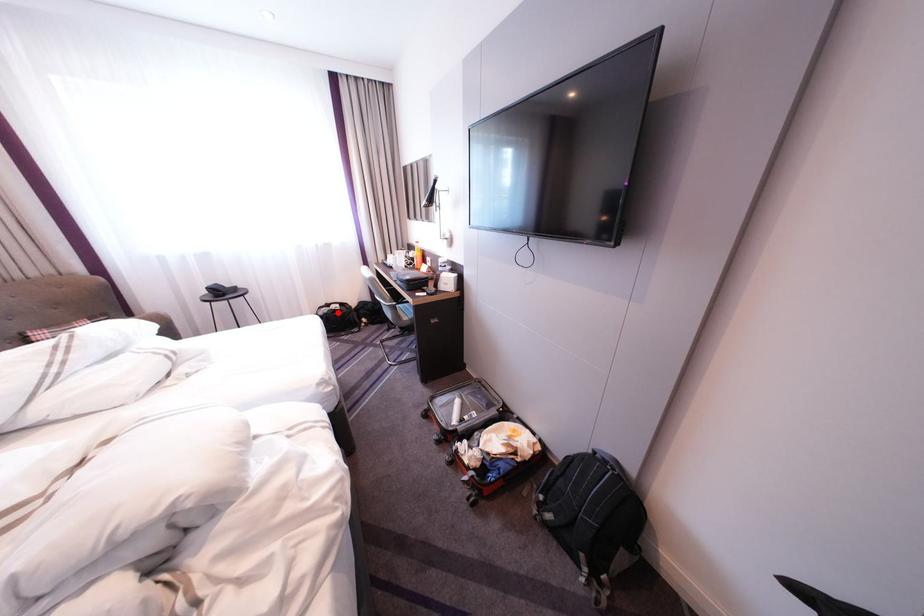
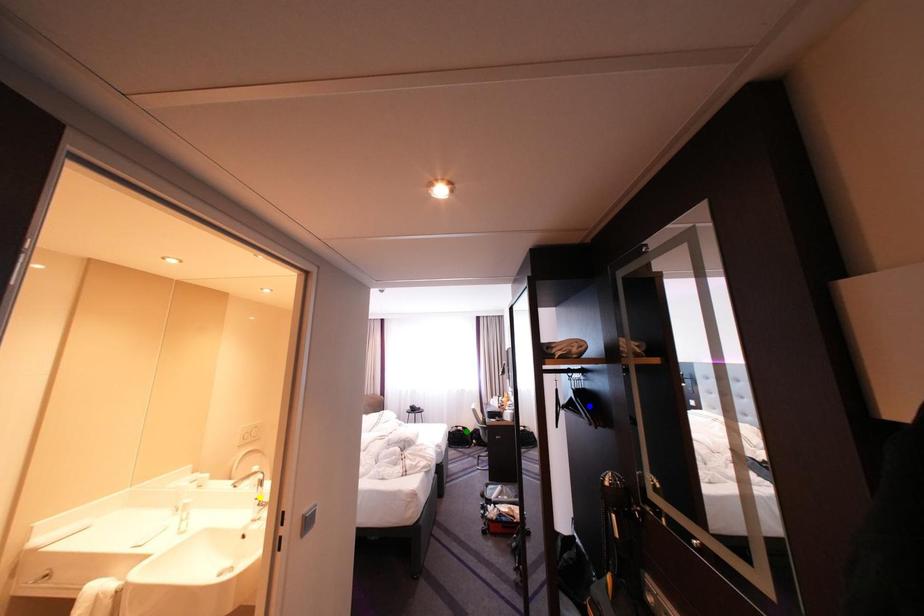
Question: I am providing you with two images of the same scene from different viewpoints. A red point is marked on the first image. You are given multiple points on the second image. In image 2, which mark is for the same physical point as the one in image 1?

Choices:
 (A) blue point
 (B) green point
 (C) yellow point

Answer: (B)